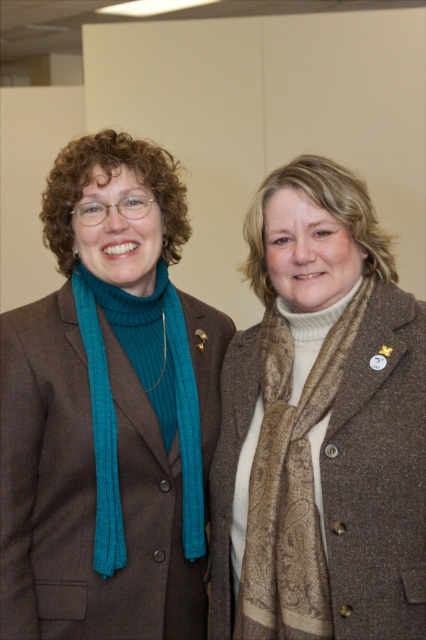
Who is more distant from viewer, (307,592) or (166,362)?

Positioned behind is point (166,362).

Does brown paisley scarf at center have a lesser height compared to teal ribbed scarf at left?

No.

Who is more forward, [302,611] or [95,554]?

Point [302,611] is more forward.

Where is `brown paisley scarf at center`? brown paisley scarf at center is located at coordinates (290, 486).

Which is behind, point (17, 312) or point (267, 481)?

Positioned behind is point (17, 312).

Does teal knitted scarf at left lie in front of brown paisley scarf at center?

Yes, it is in front of brown paisley scarf at center.

Locate an element on the screen. teal knitted scarf at left is located at coordinates (109, 410).

Locate an element on the screen. teal knitted scarf at left is located at coordinates (109, 410).

Is teal knitted scarf at left smaller than teal ribbed scarf at left?

No, teal knitted scarf at left is not smaller than teal ribbed scarf at left.

Which is in front, point (189, 339) or point (100, 387)?

Positioned in front is point (100, 387).

Is point (94, 184) positioned after point (186, 362)?

No, it is not.

The height and width of the screenshot is (640, 426). What are the coordinates of `teal knitted scarf at left` in the screenshot? It's located at (109, 410).